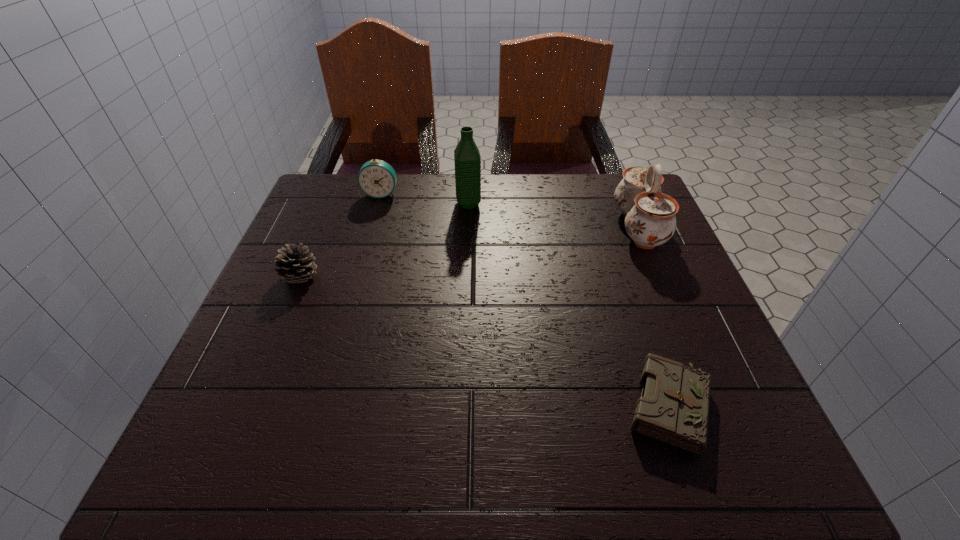
Identify the location of the third object from right to left. (467, 158).

Locate an element on the screen. Image resolution: width=960 pixels, height=540 pixels. water bottle is located at coordinates (467, 158).

Where is `chinaware`? chinaware is located at coordinates (650, 221).

Find the location of a particular element. This screenshot has height=540, width=960. alarm clock is located at coordinates (376, 178).

The height and width of the screenshot is (540, 960). I want to click on the fourth object from right to left, so click(x=376, y=178).

Locate an element on the screen. pinecone is located at coordinates (293, 264).

Find the location of `the leftmost object`. the leftmost object is located at coordinates (293, 264).

This screenshot has height=540, width=960. What are the coordinates of `diary` in the screenshot? It's located at click(673, 408).

Locate an element on the screen. the shortest object is located at coordinates (673, 408).

Where is `vacant region located 0.190m on the front of the water bottle`? vacant region located 0.190m on the front of the water bottle is located at coordinates (467, 260).